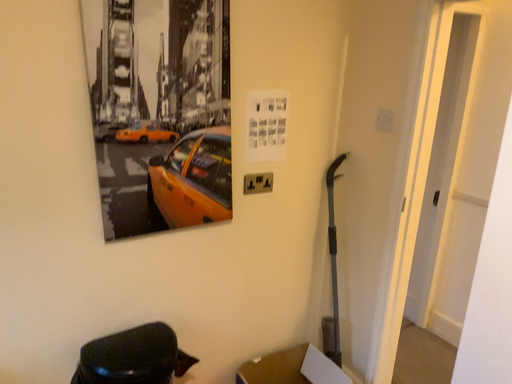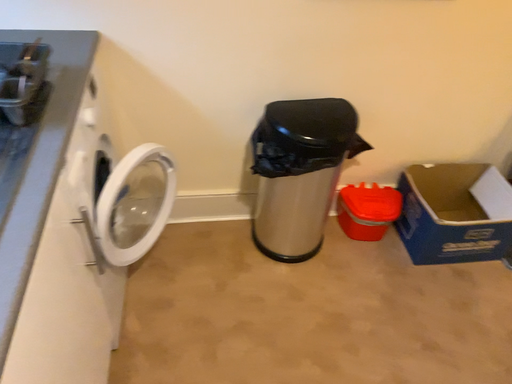
Question: Which way did the camera rotate in the video?

Choices:
 (A) rotated downward
 (B) rotated upward

Answer: (A)